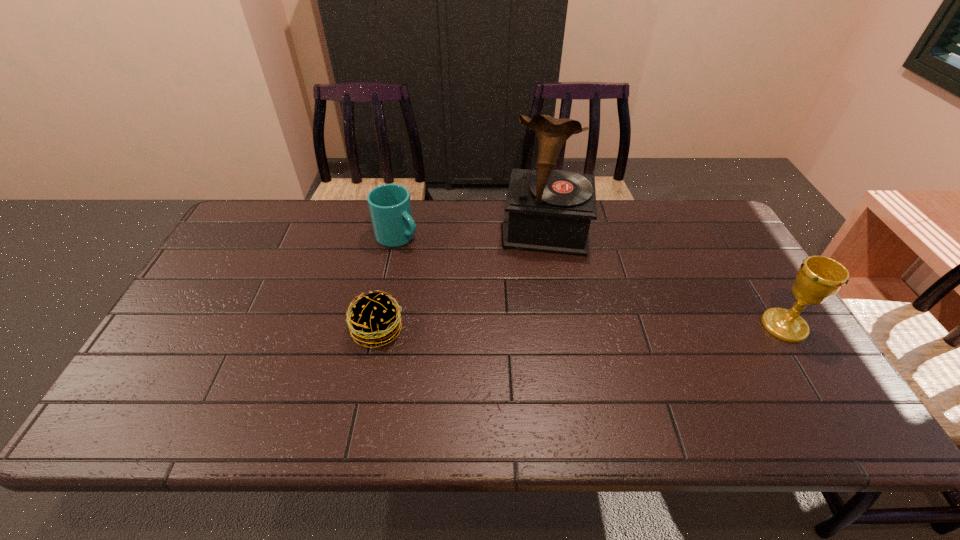
Locate an element on the screen. The image size is (960, 540). vacant space at the right edge of the desktop is located at coordinates (727, 324).

In the image, there is a desktop. In order to click on free region at the far left corner in this screenshot , I will do `click(268, 239)`.

Find the location of a particular element. The width and height of the screenshot is (960, 540). free location at the far right corner is located at coordinates (686, 207).

The width and height of the screenshot is (960, 540). What are the coordinates of `empty location between the second tallest object and the shortest object` in the screenshot? It's located at (581, 328).

Locate an element on the screen. The width and height of the screenshot is (960, 540). unoccupied position between the second shortest object and the second object from right to left is located at coordinates (472, 234).

This screenshot has height=540, width=960. What are the coordinates of `vacant point located between the shortest object and the chalice` in the screenshot? It's located at (581, 328).

Locate an element on the screen. vacant area between the third shortest object and the patty is located at coordinates (581, 328).

At what (x,y) coordinates should I click in order to perform the action: click on vacant space in between the shortest object and the cup. Please return your answer as a coordinate pair (x, y). The height and width of the screenshot is (540, 960). Looking at the image, I should click on (388, 284).

You are a GUI agent. You are given a task and a screenshot of the screen. Output one action in this format:
    pyautogui.click(x=<x>, y=<y>)
    Task: Click on the free point between the cup and the tallest object
    The height and width of the screenshot is (540, 960).
    Given the screenshot: What is the action you would take?
    pyautogui.click(x=472, y=234)

I want to click on free area in between the patty and the third object from left to right, so click(x=462, y=281).